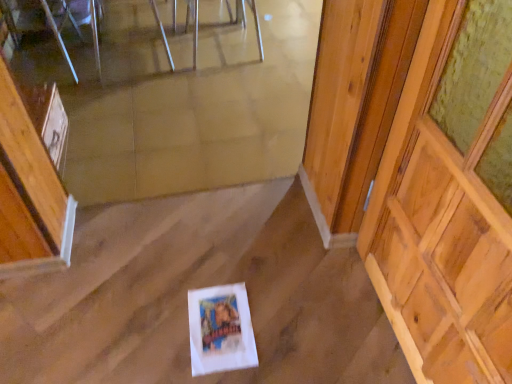
Question: Does metallic reflective chair at upper center, which is the 2th chair in left-to-right order, appear on the right side of wooden at right?

Choices:
 (A) no
 (B) yes

Answer: (A)

Question: Can you confirm if metallic reflective chair at upper center, which is the 2th chair in left-to-right order, is smaller than wooden at right?

Choices:
 (A) no
 (B) yes

Answer: (A)

Question: Could you tell me if metallic reflective chair at upper center, the first chair positioned from the right, is facing wooden at right?

Choices:
 (A) no
 (B) yes

Answer: (A)

Question: Is metallic reflective chair at upper center, the first chair positioned from the right, wider than wooden at right?

Choices:
 (A) no
 (B) yes

Answer: (B)

Question: Does metallic reflective chair at upper center, the first chair positioned from the right, come in front of wooden at right?

Choices:
 (A) no
 (B) yes

Answer: (A)

Question: Is metallic reflective chair at upper center, which is the 2th chair in left-to-right order, shorter than wooden at right?

Choices:
 (A) yes
 (B) no

Answer: (A)

Question: Is metallic silver chair at upper center, which is the first chair from left to right, shorter than wooden at right?

Choices:
 (A) yes
 (B) no

Answer: (A)

Question: Is metallic silver chair at upper center, which is the first chair from left to right, located outside wooden at right?

Choices:
 (A) yes
 (B) no

Answer: (A)

Question: Considering the relative sizes of metallic silver chair at upper center, which is the second chair in right-to-left order, and wooden at right in the image provided, is metallic silver chair at upper center, which is the second chair in right-to-left order, smaller than wooden at right?

Choices:
 (A) yes
 (B) no

Answer: (B)

Question: Does metallic silver chair at upper center, which is the second chair in right-to-left order, appear on the right side of wooden at right?

Choices:
 (A) yes
 (B) no

Answer: (B)

Question: Does metallic silver chair at upper center, which is the first chair from left to right, have a greater height compared to wooden at right?

Choices:
 (A) no
 (B) yes

Answer: (A)

Question: Are metallic silver chair at upper center, which is the second chair in right-to-left order, and wooden at right far apart?

Choices:
 (A) yes
 (B) no

Answer: (A)

Question: Is wooden at right with clear glass table at upper center?

Choices:
 (A) yes
 (B) no

Answer: (B)